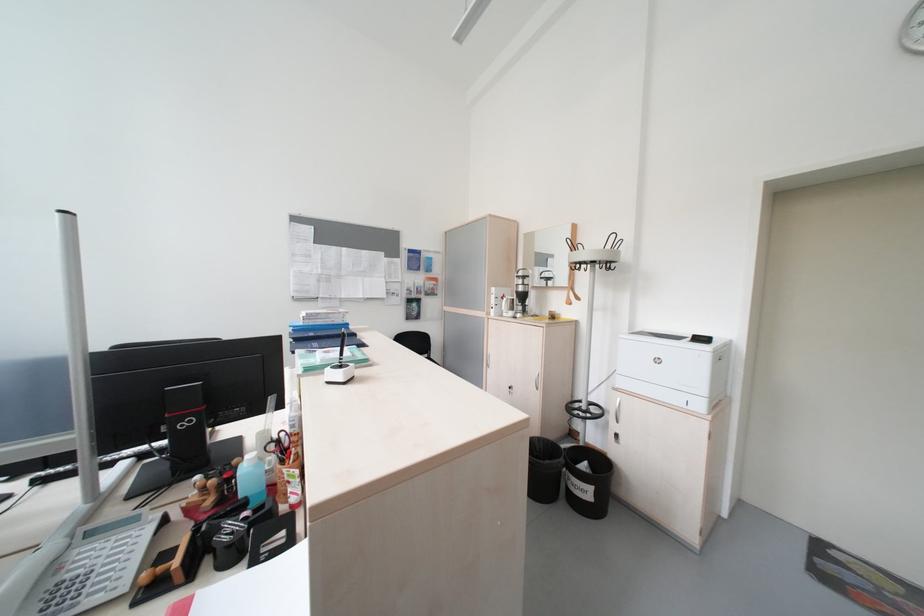
Describe the element at coordinates (685, 342) in the screenshot. I see `the white printer lid` at that location.